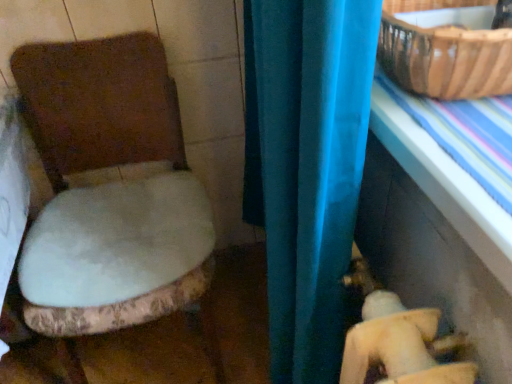
This screenshot has height=384, width=512. What do you see at coordinates (444, 53) in the screenshot? I see `brown woven basket at upper right` at bounding box center [444, 53].

Describe the element at coordinates (99, 103) in the screenshot. I see `white plush toilet seat at left` at that location.

Image resolution: width=512 pixels, height=384 pixels. Describe the element at coordinates (435, 231) in the screenshot. I see `blue plastic table at right` at that location.

This screenshot has height=384, width=512. In order to click on brown woven basket at upper right in this screenshot , I will do `click(444, 53)`.

From the image's perspective, relative to blue plastic table at right, is brown woven basket at upper right above or below?

Clearly, from the image's perspective, brown woven basket at upper right is above blue plastic table at right.

What's the angular difference between brown woven basket at upper right and blue plastic table at right's facing directions?

2.02 degrees separate the facing orientations of brown woven basket at upper right and blue plastic table at right.

Which object is positioned more to the left, brown woven basket at upper right or blue plastic table at right?

Positioned to the left is blue plastic table at right.

I want to click on table on the right of white plush toilet seat at left, so click(435, 231).

Looking at this image, is blue plastic table at right facing away from white plush toilet seat at left?

No, blue plastic table at right's orientation is not away from white plush toilet seat at left.

From a real-world perspective, is blue plastic table at right physically below white plush toilet seat at left?

Incorrect, from a real-world perspective, blue plastic table at right is higher than white plush toilet seat at left.

Where is `toilet behind the blue plastic table at right`? Image resolution: width=512 pixels, height=384 pixels. toilet behind the blue plastic table at right is located at coordinates [x=99, y=103].

Does white plush toilet seat at left have a lesser height compared to blue plastic table at right?

In fact, white plush toilet seat at left may be taller than blue plastic table at right.

From a real-world perspective, is white plush toilet seat at left below blue plastic table at right?

Correct, in the physical world, white plush toilet seat at left is lower than blue plastic table at right.

In terms of size, does white plush toilet seat at left appear bigger or smaller than blue plastic table at right?

white plush toilet seat at left is bigger than blue plastic table at right.

From a real-world perspective, relative to brown woven basket at upper right, is white plush toilet seat at left vertically above or below?

In terms of real-world spatial position, white plush toilet seat at left is below brown woven basket at upper right.

Is white plush toilet seat at left oriented towards brown woven basket at upper right?

No, white plush toilet seat at left does not turn towards brown woven basket at upper right.

Is the depth of white plush toilet seat at left greater than that of brown woven basket at upper right?

Yes, it is.

Does point (503, 365) lie in front of point (424, 47)?

Yes, it is in front of point (424, 47).

Can you confirm if blue plastic table at right is bigger than brown woven basket at upper right?

Yes.

Is blue plastic table at right directly adjacent to brown woven basket at upper right?

No, blue plastic table at right is not in contact with brown woven basket at upper right.

Is blue plastic table at right oriented towards brown woven basket at upper right?

No, blue plastic table at right is not turned towards brown woven basket at upper right.

Looking at the image, does brown woven basket at upper right seem bigger or smaller compared to white plush toilet seat at left?

Considering their sizes, brown woven basket at upper right takes up less space than white plush toilet seat at left.

Considering the sizes of objects brown woven basket at upper right and white plush toilet seat at left in the image provided, who is wider, brown woven basket at upper right or white plush toilet seat at left?

white plush toilet seat at left is wider.

The width and height of the screenshot is (512, 384). Identify the location of table located below the brown woven basket at upper right (from the image's perspective). (435, 231).

Where is `table on the right of white plush toilet seat at left`? This screenshot has height=384, width=512. table on the right of white plush toilet seat at left is located at coordinates (435, 231).

Looking at the image, which one is located further to white plush toilet seat at left, brown woven basket at upper right or blue plastic table at right?

brown woven basket at upper right lies further to white plush toilet seat at left than the other object.

When comparing their distances from brown woven basket at upper right, does blue plastic table at right or white plush toilet seat at left seem further?

Answer: The object further to brown woven basket at upper right is white plush toilet seat at left.

Which object lies nearer to the anchor point white plush toilet seat at left, blue plastic table at right or brown woven basket at upper right?

blue plastic table at right lies closer to white plush toilet seat at left than the other object.

Which object lies further to the anchor point blue plastic table at right, white plush toilet seat at left or brown woven basket at upper right?

Based on the image, white plush toilet seat at left appears to be further to blue plastic table at right.

Based on their spatial positions, is brown woven basket at upper right or white plush toilet seat at left further from blue plastic table at right?

white plush toilet seat at left.

Looking at the image, which one is located further to brown woven basket at upper right, white plush toilet seat at left or blue plastic table at right?

white plush toilet seat at left lies further to brown woven basket at upper right than the other object.

Where is `table located between white plush toilet seat at left and brown woven basket at upper right in the left-right direction`? Image resolution: width=512 pixels, height=384 pixels. table located between white plush toilet seat at left and brown woven basket at upper right in the left-right direction is located at coordinates (435, 231).